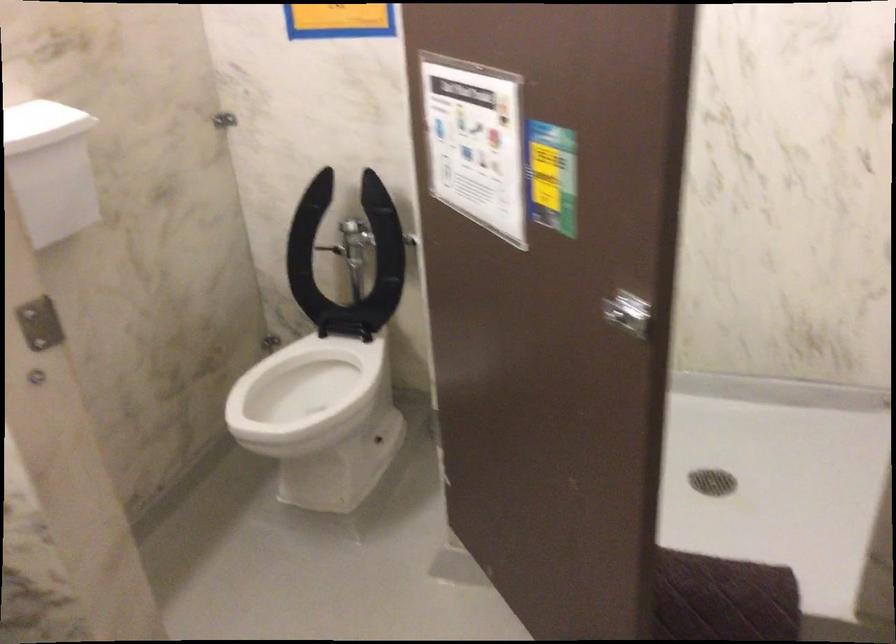
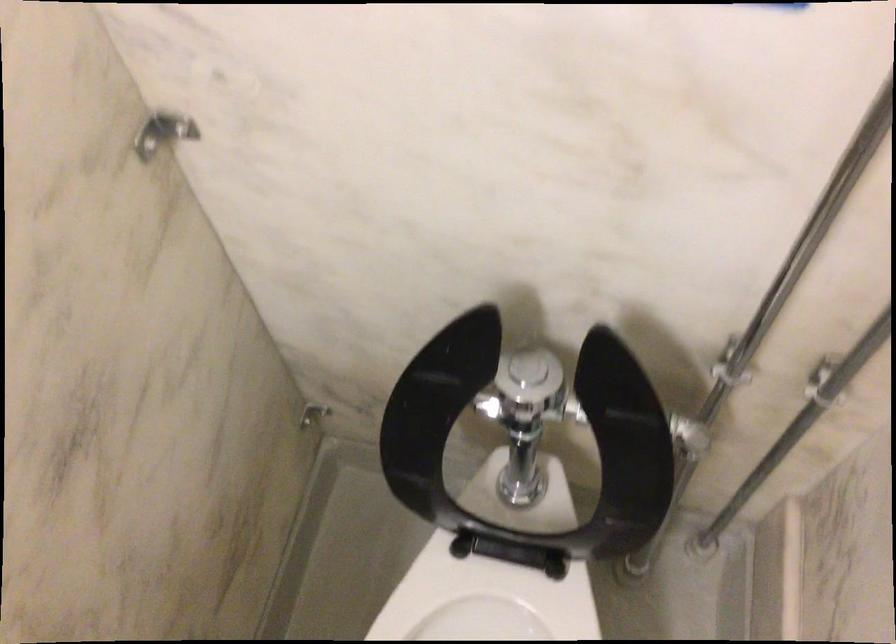
The point at (x=334, y=375) is marked in the first image. Where is the corresponding point in the second image?

(487, 605)